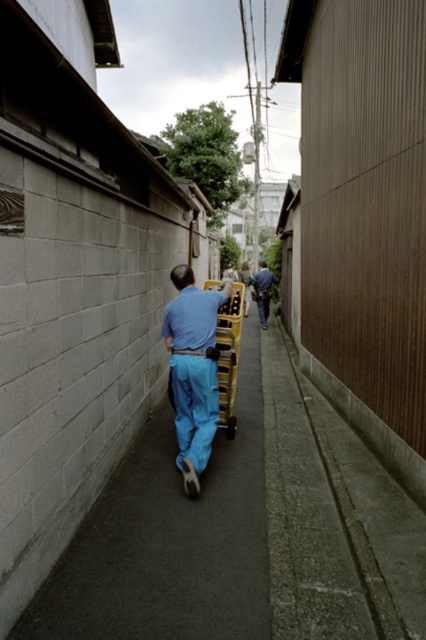
You are a delivery person standing in the alleyway and need to step onto the smooth asphalt pavement at center to avoid the wooden wall on the right. Can you step onto it without your blue jeans at center getting caught?

The smooth asphalt pavement at center is shorter than blue jeans at center, so stepping onto it might cause your blue jeans at center to get caught since the pavement is lower than the jeans.

You are a delivery person who needs to check if your matte blue pants at center and blue jeans at center are positioned correctly on the cart. According to the scene, which one is on the left side?

The matte blue pants at center are positioned to the left of the blue jeans at center.

You are standing at the point labeled point (169, 540) in the alleyway. What type of surface are you currently standing on?

The smooth asphalt pavement at center is located at point (169, 540), so you are standing on the smooth asphalt pavement at center.